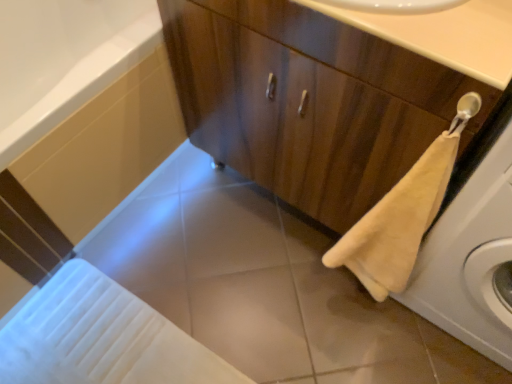
Question: Is wooden cabinet at center outside of white glossy bath at lower left?

Choices:
 (A) no
 (B) yes

Answer: (B)

Question: Is wooden cabinet at center at the right side of white glossy bath at lower left?

Choices:
 (A) yes
 (B) no

Answer: (A)

Question: Can you confirm if wooden cabinet at center is shorter than white glossy bath at lower left?

Choices:
 (A) no
 (B) yes

Answer: (A)

Question: Can you confirm if wooden cabinet at center is positioned to the left of white glossy bath at lower left?

Choices:
 (A) yes
 (B) no

Answer: (B)

Question: Is wooden cabinet at center positioned in front of white glossy bath at lower left?

Choices:
 (A) no
 (B) yes

Answer: (B)

Question: From the image's perspective, is wooden cabinet at center beneath white glossy bath at lower left?

Choices:
 (A) yes
 (B) no

Answer: (A)

Question: Is wooden cabinet at center to the right of smooth beige countertop at upper center from the viewer's perspective?

Choices:
 (A) no
 (B) yes

Answer: (A)

Question: Does wooden cabinet at center have a lesser height compared to smooth beige countertop at upper center?

Choices:
 (A) yes
 (B) no

Answer: (B)

Question: Is wooden cabinet at center wider than smooth beige countertop at upper center?

Choices:
 (A) yes
 (B) no

Answer: (A)

Question: Is wooden cabinet at center positioned before smooth beige countertop at upper center?

Choices:
 (A) no
 (B) yes

Answer: (B)

Question: Is smooth beige countertop at upper center surrounded by wooden cabinet at center?

Choices:
 (A) yes
 (B) no

Answer: (A)

Question: Would you say wooden cabinet at center is a long distance from smooth beige countertop at upper center?

Choices:
 (A) no
 (B) yes

Answer: (A)

Question: From the image's perspective, is wooden cabinet at center located beneath beige fabric washing machine at right?

Choices:
 (A) yes
 (B) no

Answer: (B)